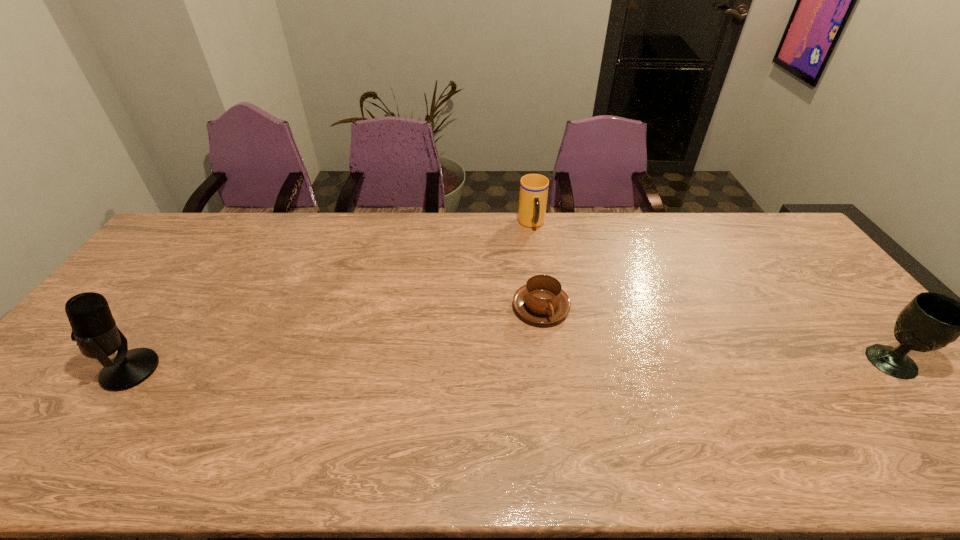
The width and height of the screenshot is (960, 540). Identify the location of vacant space that's between the chalice and the cappuccino. (716, 335).

Where is `empty location between the microphone and the rightmost object`? empty location between the microphone and the rightmost object is located at coordinates (511, 366).

What are the coordinates of `free space between the shortest object and the third shortest object` in the screenshot? It's located at [716, 335].

Where is `free space between the leftmost object and the rightmost object`? This screenshot has width=960, height=540. free space between the leftmost object and the rightmost object is located at coordinates point(511,366).

Locate an element on the screen. unoccupied position between the shortest object and the farthest object is located at coordinates (537, 266).

In order to click on object identified as the second closest to the leftmost object in this screenshot , I will do `click(533, 195)`.

This screenshot has height=540, width=960. In order to click on object that is the closest to the microphone in this screenshot , I will do `click(541, 300)`.